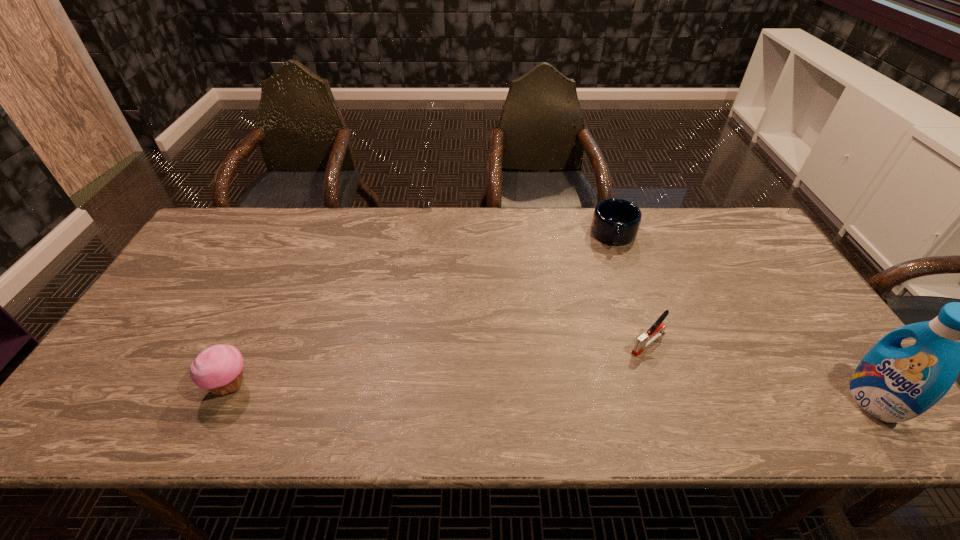
At what (x,y) coordinates should I click in order to perform the action: click on vacant region at the left edge of the desktop. Please return your answer as a coordinate pair (x, y). The height and width of the screenshot is (540, 960). Looking at the image, I should click on (162, 358).

Locate an element on the screen. The height and width of the screenshot is (540, 960). vacant area at the far left corner is located at coordinates (226, 244).

The height and width of the screenshot is (540, 960). Find the location of `free space at the far right corner of the desktop`. free space at the far right corner of the desktop is located at coordinates (724, 227).

Identify the location of unoccupied position between the third nearest object and the rightmost object. (760, 372).

Identify the location of vacant space that is in between the stapler and the farthest object. (632, 289).

You are a GUI agent. You are given a task and a screenshot of the screen. Output one action in this format:
    pyautogui.click(x=<x>, y=<y>)
    Task: Click on the free point between the rightmost object and the farthest object
    The image size is (960, 540).
    Given the screenshot: What is the action you would take?
    (x=743, y=318)

What are the coordinates of `vacant space in between the tallest object and the stapler` in the screenshot? It's located at (760, 372).

The image size is (960, 540). I want to click on free spot between the farthest object and the cupcake, so click(422, 310).

I want to click on unoccupied position between the detergent and the second tallest object, so click(x=552, y=393).

The width and height of the screenshot is (960, 540). Find the location of `blank region between the cupcake and the third nearest object`. blank region between the cupcake and the third nearest object is located at coordinates (440, 364).